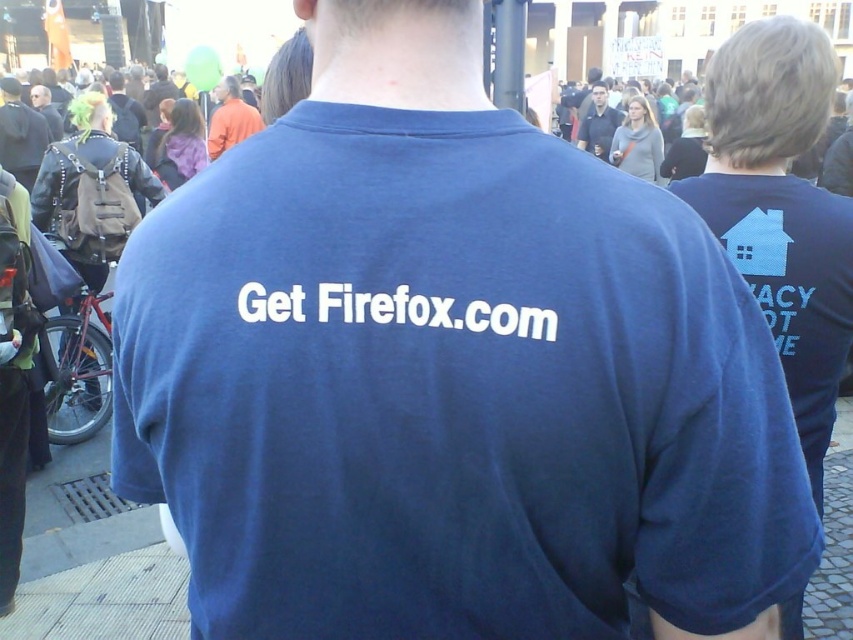
Question: Which point is farther from the camera taking this photo?

Choices:
 (A) (621, 540)
 (B) (20, 122)
 (C) (595, 131)
 (D) (248, 125)

Answer: (C)

Question: Can you confirm if matte black backpack at left is positioned to the left of dark blue shirt at center?

Choices:
 (A) no
 (B) yes

Answer: (B)

Question: Can you confirm if matte black backpack at left is positioned below orange cotton shirt at upper center?

Choices:
 (A) no
 (B) yes

Answer: (B)

Question: Among these objects, which one is farthest from the camera?

Choices:
 (A) blue cotton t-shirt at center
 (B) matte black backpack at left
 (C) orange cotton shirt at upper center

Answer: (B)

Question: Which of these objects is positioned farthest from the dark blue shirt at center?

Choices:
 (A) orange cotton shirt at upper center
 (B) blue cotton t-shirt at center

Answer: (B)

Question: In this image, where is matte black backpack at left located relative to orange cotton shirt at upper center?

Choices:
 (A) left
 (B) right

Answer: (A)